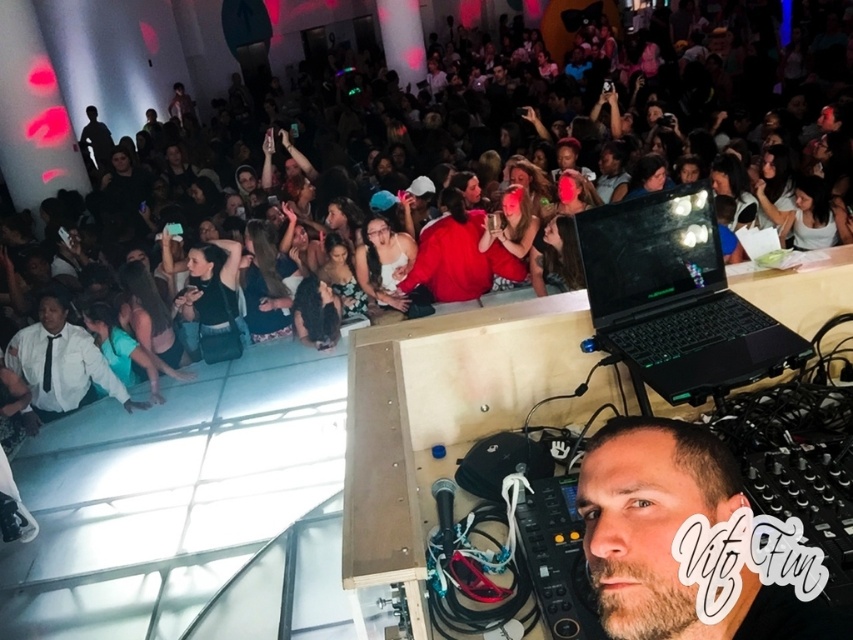
Question: Estimate the real-world distances between objects in this image. Which object is closer to the white shirt at lower left?

Choices:
 (A) glossy black laptop at center
 (B) beige matte face at center

Answer: (A)

Question: Considering the relative positions of beige matte face at center and white shirt at lower left in the image provided, where is beige matte face at center located with respect to white shirt at lower left?

Choices:
 (A) right
 (B) left

Answer: (A)

Question: Does beige matte face at center lie behind glossy black laptop at center?

Choices:
 (A) yes
 (B) no

Answer: (B)

Question: Which object appears farthest from the camera in this image?

Choices:
 (A) white shirt at lower left
 (B) beige matte face at center
 (C) glossy black laptop at center

Answer: (A)

Question: Which object is closer to the camera taking this photo?

Choices:
 (A) white shirt at lower left
 (B) beige matte face at center

Answer: (B)

Question: Is glossy black laptop at center bigger than white shirt at lower left?

Choices:
 (A) yes
 (B) no

Answer: (B)